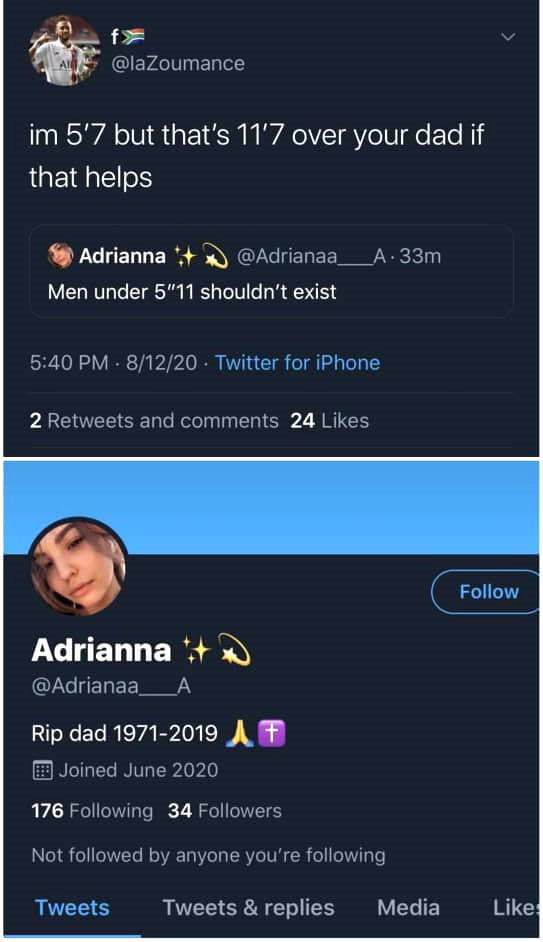
This screenshot has height=942, width=543. What are the coordinates of `trophy` in the screenshot? It's located at (86, 52).